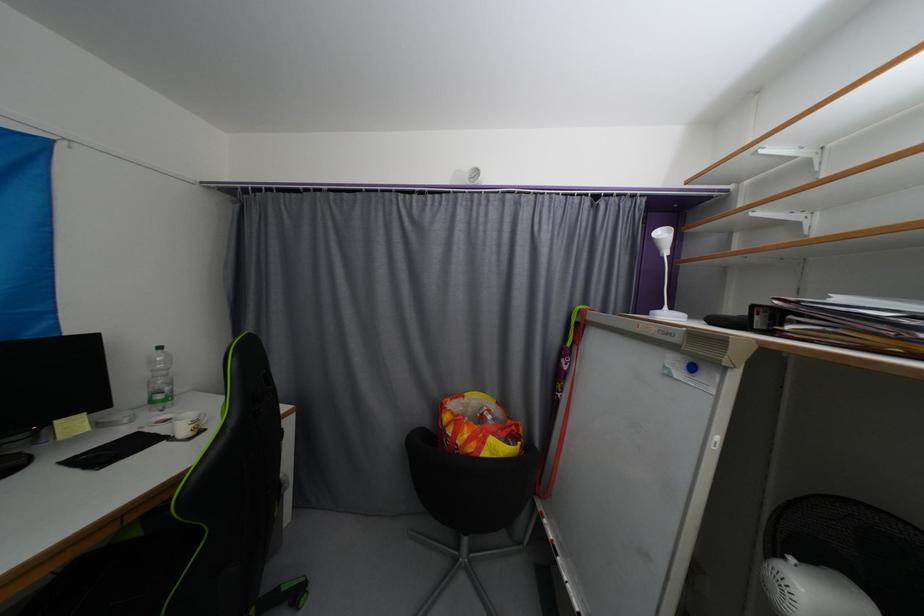
Image resolution: width=924 pixels, height=616 pixels. In order to click on white electric fan in this screenshot , I will do `click(852, 546)`.